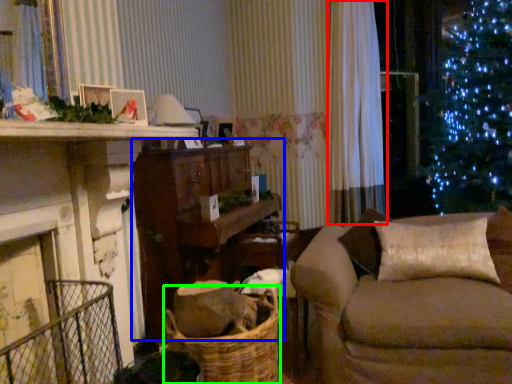
Question: Which object is the closest to the curtain (highlighted by a red box)? Choose among these: table (highlighted by a blue box) or basket (highlighted by a green box).

Choices:
 (A) table
 (B) basket

Answer: (A)